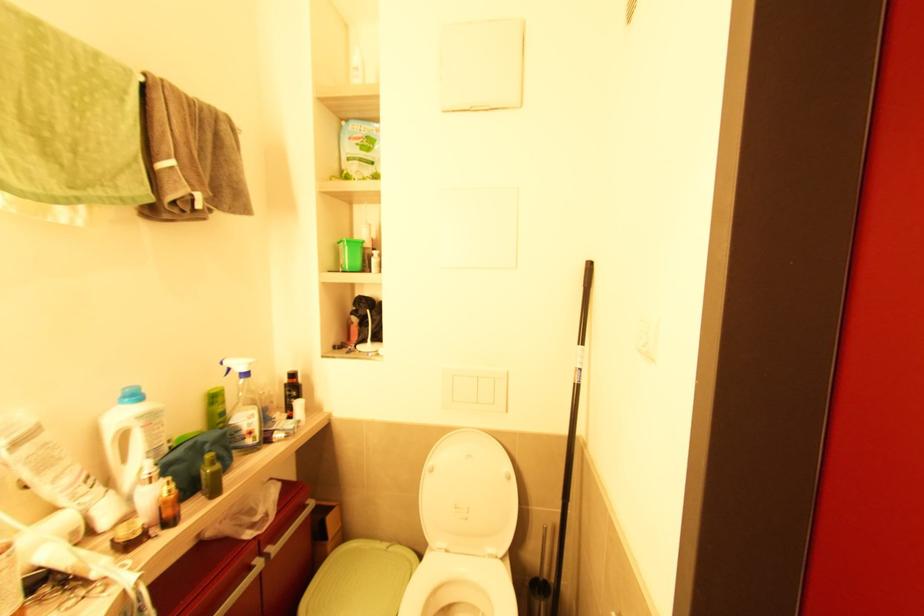
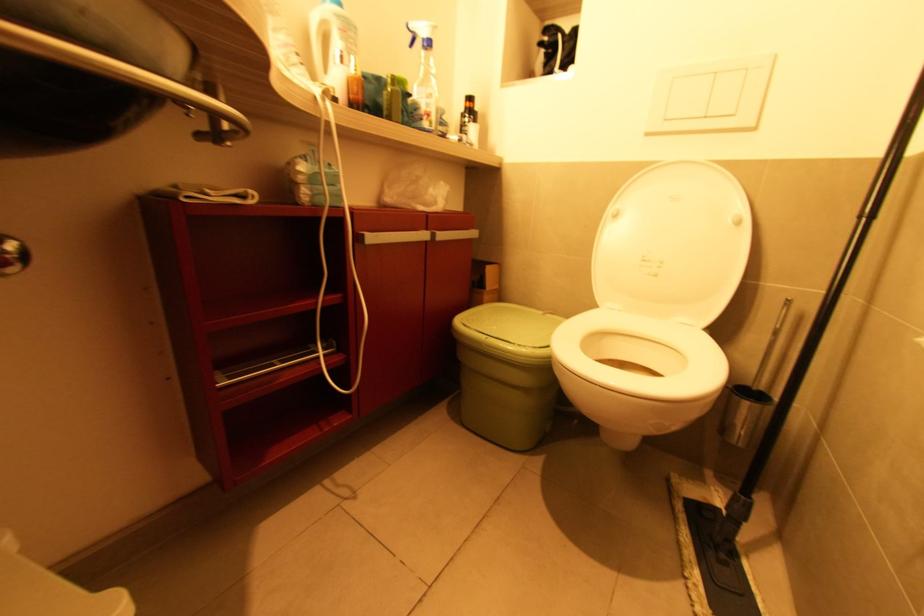
Question: How did the camera likely rotate?

Choices:
 (A) Left
 (B) Right
 (C) Up
 (D) Down

Answer: (A)